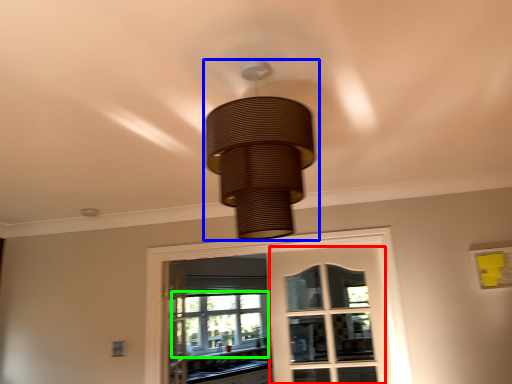
Question: Which object is positioned closest to screen door (highlighted by a red box)? Select from lamp (highlighted by a blue box) and bay window (highlighted by a green box).

Choices:
 (A) lamp
 (B) bay window

Answer: (B)